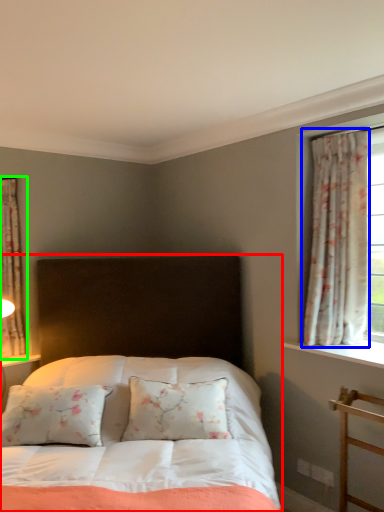
Question: Estimate the real-world distances between objects in this image. Which object is farther from bed (highlighted by a red box), curtain (highlighted by a blue box) or curtain (highlighted by a green box)?

Choices:
 (A) curtain
 (B) curtain

Answer: (B)